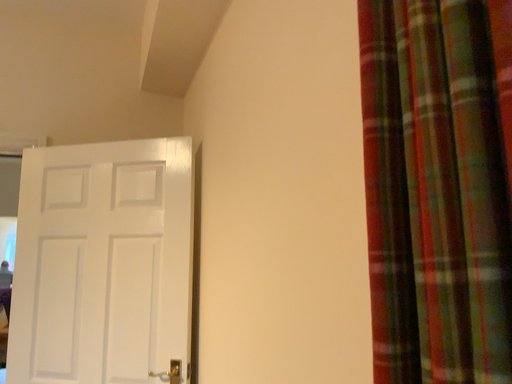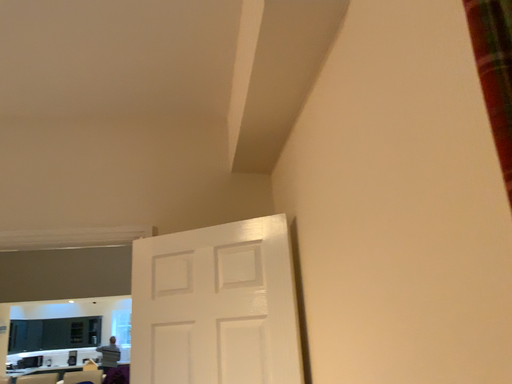
Question: How did the camera likely rotate when shooting the video?

Choices:
 (A) rotated upward
 (B) rotated downward

Answer: (A)